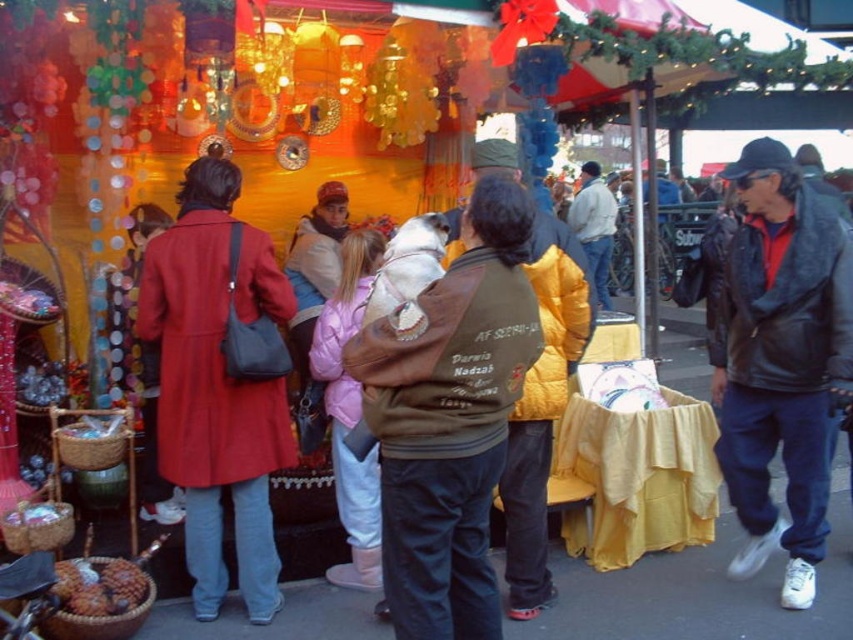
Does brown leather jacket at center appear on the right side of matte red coat at left?

Yes, brown leather jacket at center is to the right of matte red coat at left.

Looking at this image, which is more to the left, brown leather jacket at center or matte red coat at left?

From the viewer's perspective, matte red coat at left appears more on the left side.

Which is behind, point (422, 388) or point (259, 300)?

The point (259, 300) is behind.

Identify the location of brown leather jacket at center. This screenshot has width=853, height=640. (450, 417).